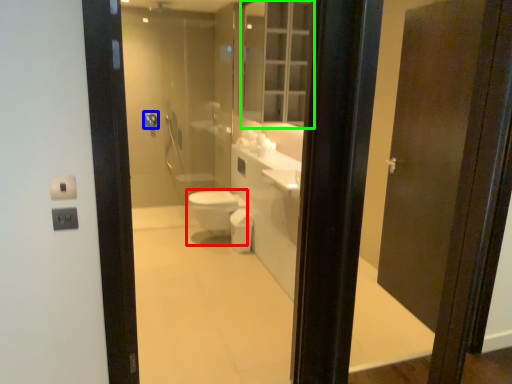
Question: Which object is positioned closest to bidet (highlighted by a red box)? Select from towel bar (highlighted by a blue box) and medicine cabinet (highlighted by a green box).

Choices:
 (A) towel bar
 (B) medicine cabinet

Answer: (B)